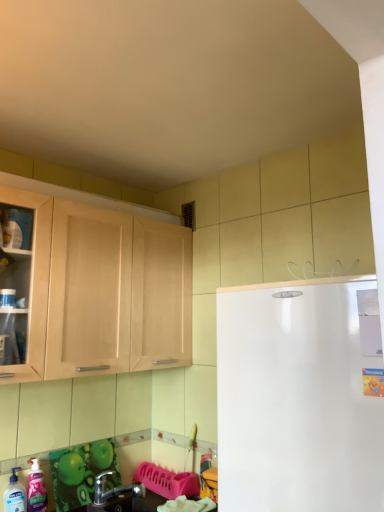
Question: Based on their sizes in the image, would you say green glossy countertop at lower left is bigger or smaller than white smooth refrigerator at right?

Choices:
 (A) small
 (B) big

Answer: (A)

Question: Does point (x=155, y=508) appear closer or farther from the camera than point (x=369, y=490)?

Choices:
 (A) closer
 (B) farther

Answer: (B)

Question: Based on their relative distances, which object is nearer to the translucent plastic soap dispenser at lower left, which is the second cleaning product in right-to-left order?

Choices:
 (A) light wood cabinet at left
 (B) metallic silver faucet at lower left
 (C) white smooth refrigerator at right
 (D) green glossy countertop at lower left
 (E) pink glossy liquid soap at lower left, placed as the 1th cleaning product when sorted from right to left

Answer: (E)

Question: Which object is positioned farthest from the metallic silver faucet at lower left?

Choices:
 (A) pink glossy liquid soap at lower left, placed as the 1th cleaning product when sorted from right to left
 (B) green glossy countertop at lower left
 (C) light wood cabinet at left
 (D) translucent plastic soap dispenser at lower left, which is the second cleaning product in right-to-left order
 (E) white smooth refrigerator at right

Answer: (E)